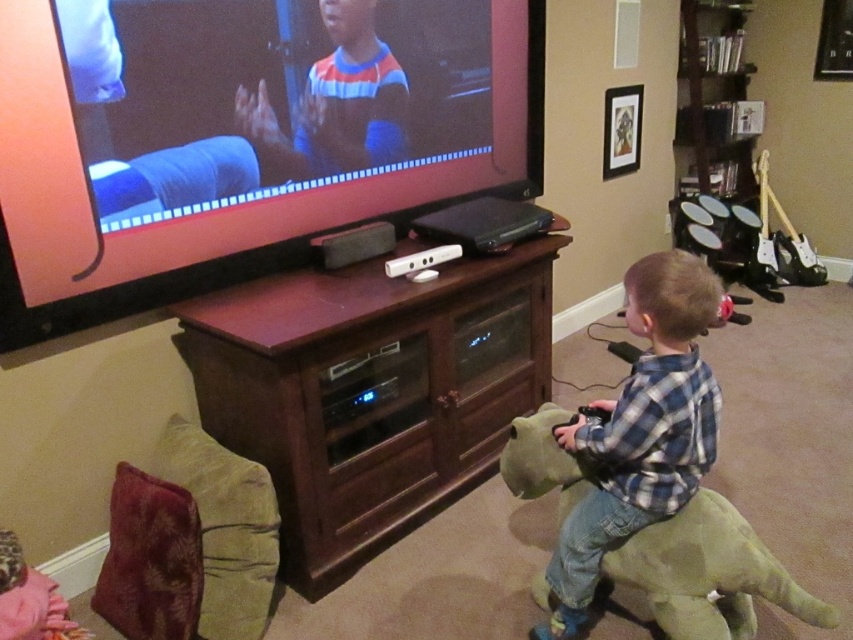
Can you confirm if brown wood entertainment center at center is wider than blue plaid shirt at lower right?

Correct, the width of brown wood entertainment center at center exceeds that of blue plaid shirt at lower right.

Who is more distant from viewer, (450, 276) or (717, 406)?

Point (450, 276)

The image size is (853, 640). What do you see at coordinates (370, 392) in the screenshot?
I see `brown wood entertainment center at center` at bounding box center [370, 392].

Where is `brown wood entertainment center at center`? brown wood entertainment center at center is located at coordinates (370, 392).

Is brown wood entertainment center at center positioned before green plush dinosaur at lower right?

No, brown wood entertainment center at center is further to the viewer.

Is brown wood entertainment center at center to the right of green plush dinosaur at lower right from the viewer's perspective?

Incorrect, brown wood entertainment center at center is not on the right side of green plush dinosaur at lower right.

Which is behind, point (544, 321) or point (643, 579)?

Positioned behind is point (544, 321).

Locate an element on the screen. Image resolution: width=853 pixels, height=640 pixels. brown wood entertainment center at center is located at coordinates (370, 392).

This screenshot has width=853, height=640. What do you see at coordinates (640, 432) in the screenshot?
I see `blue plaid shirt at lower right` at bounding box center [640, 432].

Does blue plaid shirt at lower right have a greater height compared to green plush dinosaur at lower right?

Indeed, blue plaid shirt at lower right has a greater height compared to green plush dinosaur at lower right.

Identify the location of blue plaid shirt at lower right. (640, 432).

In order to click on blue plaid shirt at lower right in this screenshot , I will do `click(640, 432)`.